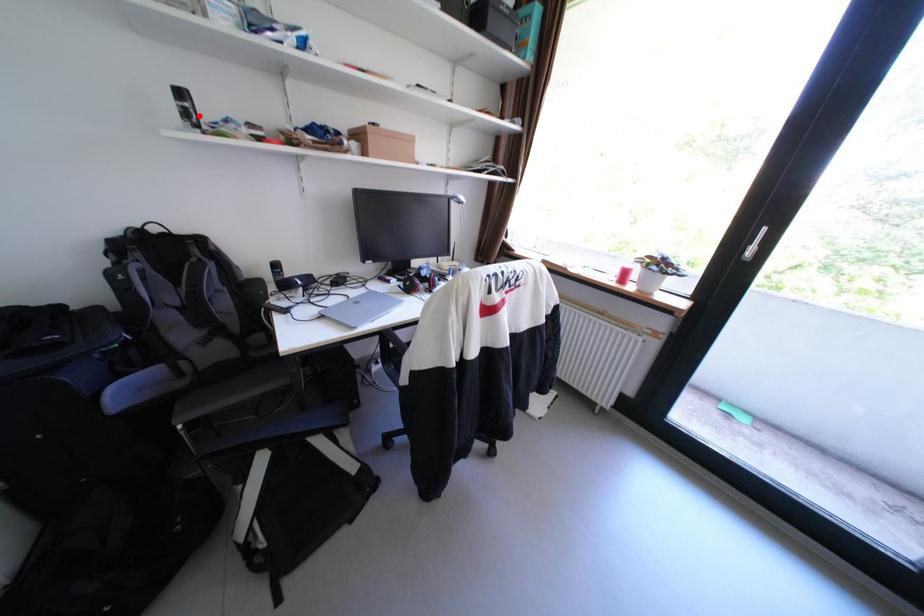
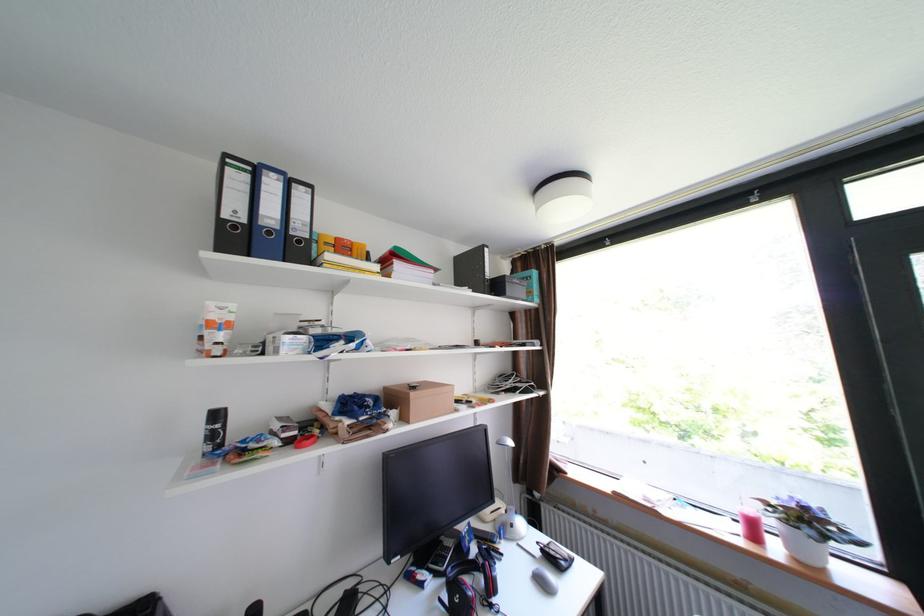
Find the pixel in the second image that matches the highlighted location in the first image.

(225, 436)